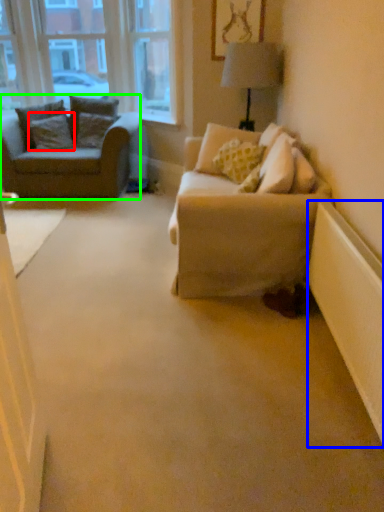
Question: Based on their relative distances, which object is farther from pillow (highlighted by a red box)? Choose from radiator (highlighted by a blue box) and studio couch (highlighted by a green box).

Choices:
 (A) radiator
 (B) studio couch

Answer: (A)